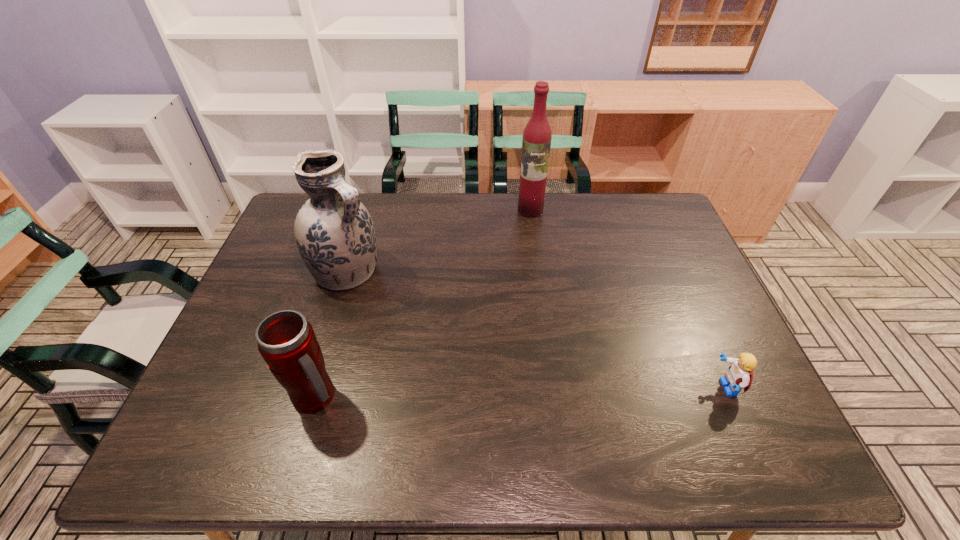
The image size is (960, 540). Identify the location of vacant space on the desktop that is between the third tallest object and the rightmost object and is positioned on the label of the third object from left to right. (483, 393).

I want to click on vacant space on the desktop that is between the thermos bottle and the rightmost object and is positioned with the handle on the side of the second farthest object, so click(x=552, y=392).